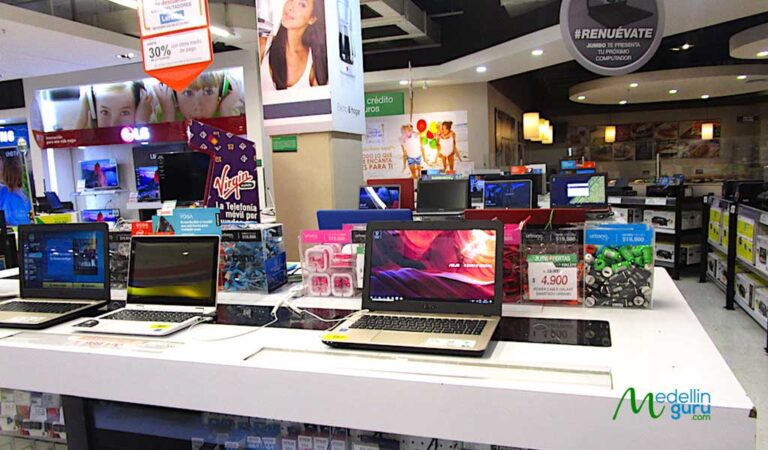
Locate an element on the screen. laptop is located at coordinates (361, 213).